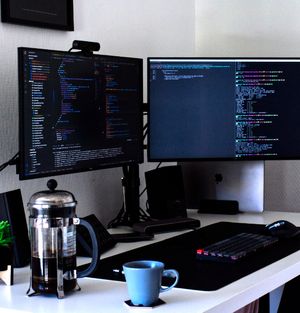
Where is `mouse`? mouse is located at coordinates (279, 224).